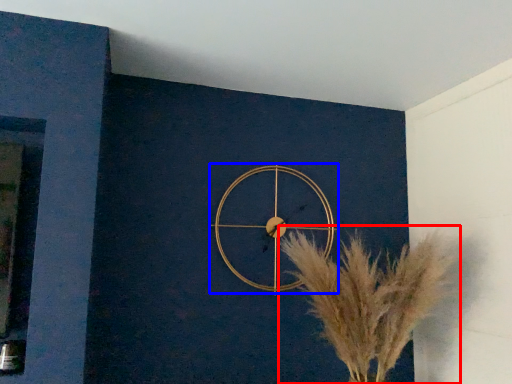
Question: Which of the following is the closest to the observer, flower (highlighted by a red box) or wall clock (highlighted by a blue box)?

Choices:
 (A) flower
 (B) wall clock

Answer: (A)